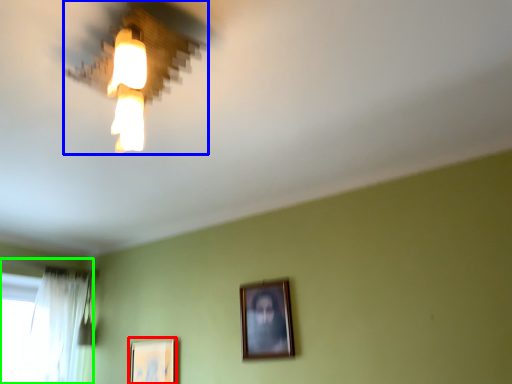
Question: Which object is positioned closest to picture frame (highlighted by a red box)? Select from lamp (highlighted by a blue box) and window (highlighted by a green box).

Choices:
 (A) lamp
 (B) window

Answer: (B)